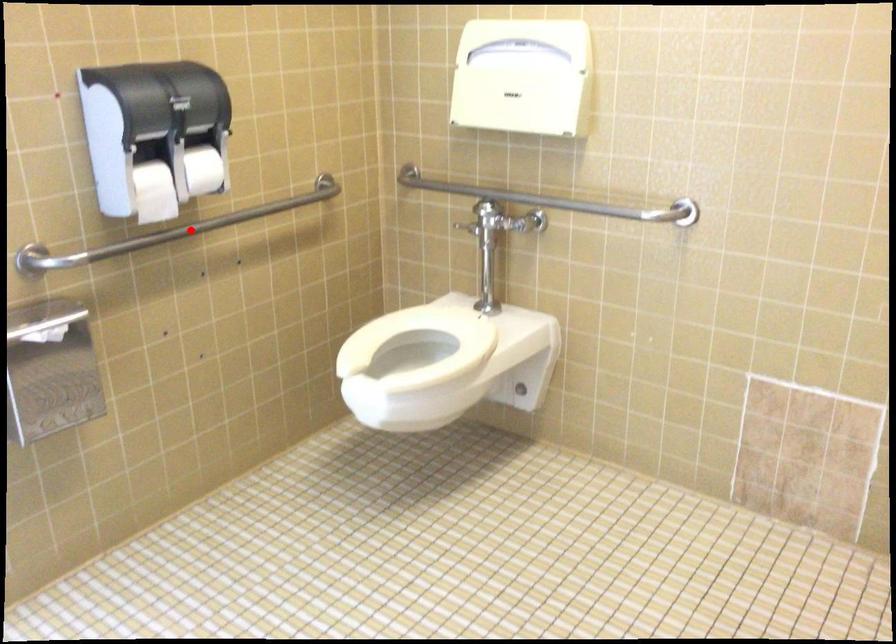
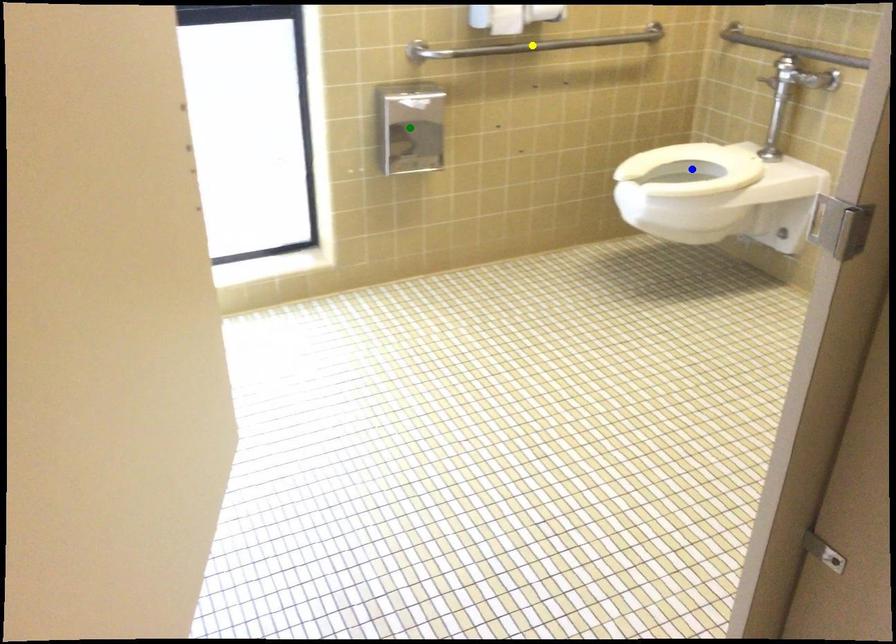
Question: I am providing you with two images of the same scene from different viewpoints. A red point is marked on the first image. You are given multiple points on the second image. Which point in image 2 is actually the same real-world point as the red point in image 1?

Choices:
 (A) yellow point
 (B) green point
 (C) blue point

Answer: (A)